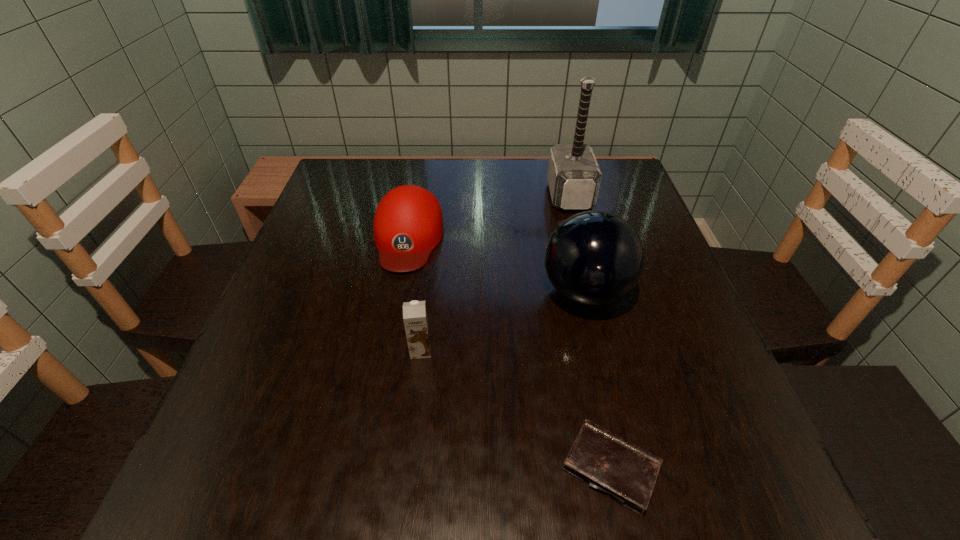
The image size is (960, 540). Identify the location of free space that satisfies the following two spatial constraints: 1. for striking with the head of the hammer; 2. on the front-facing side of the baseball cap. (581, 238).

The image size is (960, 540). What are the coordinates of `free space that satisfies the following two spatial constraints: 1. for striking with the head of the hammer; 2. on the front side of the diary` in the screenshot? It's located at (640, 468).

Identify the location of free space that satisfies the following two spatial constraints: 1. on the front side of the chocolate milk; 2. on the left side of the nearest object. The height and width of the screenshot is (540, 960). (406, 468).

Find the location of `free spot that satisfies the following two spatial constraints: 1. on the side of the second tallest object with the finger holes; 2. on the front side of the chocolate milk`. free spot that satisfies the following two spatial constraints: 1. on the side of the second tallest object with the finger holes; 2. on the front side of the chocolate milk is located at coordinates (599, 350).

The height and width of the screenshot is (540, 960). What are the coordinates of `vacant point that satisfies the following two spatial constraints: 1. for striking with the head of the hammer; 2. on the front-facing side of the baseball cap` in the screenshot? It's located at (581, 238).